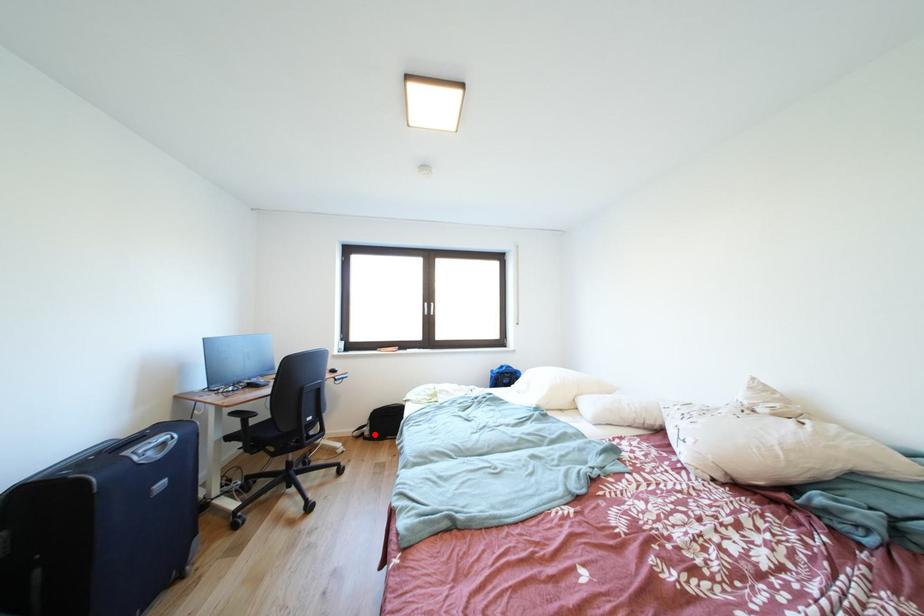
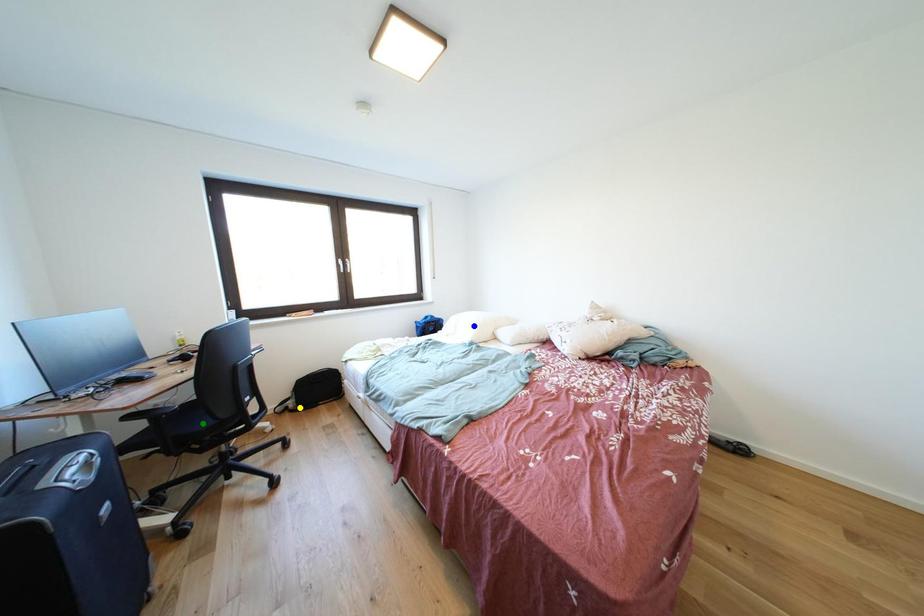
Question: I am providing you with two images of the same scene from different viewpoints. A red point is marked on the first image. You are given multiple points on the second image. Can you choose the point in image 2 that corresponds to the point in image 1?

Choices:
 (A) blue point
 (B) yellow point
 (C) green point

Answer: (B)